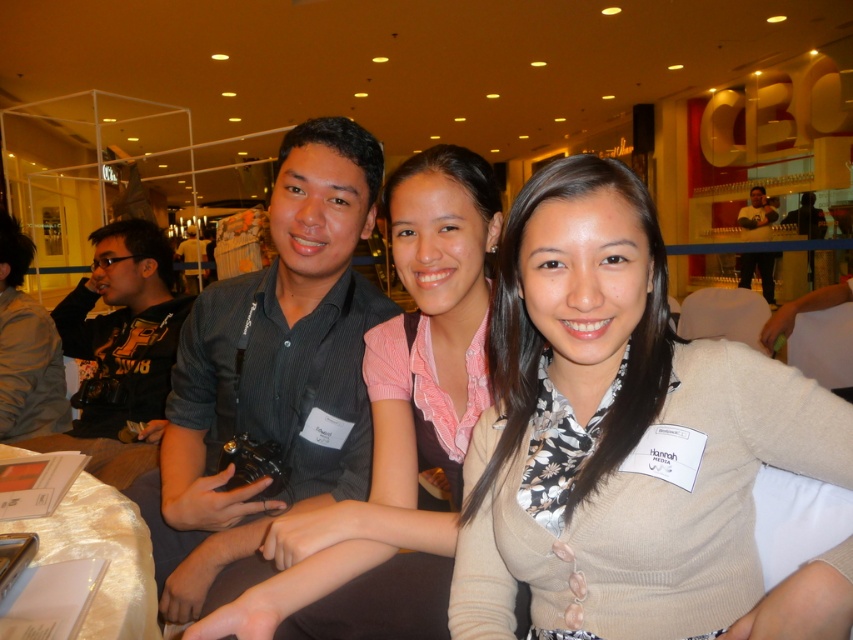
Can you confirm if dark gray shirt at left is bigger than matte black camera at upper right?

No.

Which is below, dark gray shirt at left or matte black camera at upper right?

Positioned lower is dark gray shirt at left.

Find the location of a particular element. dark gray shirt at left is located at coordinates (26, 348).

Can you confirm if black fabric camera at left is taller than dark gray shirt at left?

Indeed, black fabric camera at left has a greater height compared to dark gray shirt at left.

Between point (74, 291) and point (9, 241), which one is positioned in front?

Point (9, 241)

Where is `black fabric camera at left`? black fabric camera at left is located at coordinates (120, 349).

Between beige cardigan at center and dark gray shirt at left, which one has less height?

Standing shorter between the two is beige cardigan at center.

Which is above, beige cardigan at center or dark gray shirt at left?

dark gray shirt at left is higher up.

Who is more forward, (535, 532) or (4, 426)?

Point (535, 532) is in front.

You are a GUI agent. You are given a task and a screenshot of the screen. Output one action in this format:
    pyautogui.click(x=<x>, y=<y>)
    Task: Click on the beige cardigan at center
    This screenshot has width=853, height=640.
    Given the screenshot: What is the action you would take?
    pyautogui.click(x=618, y=432)